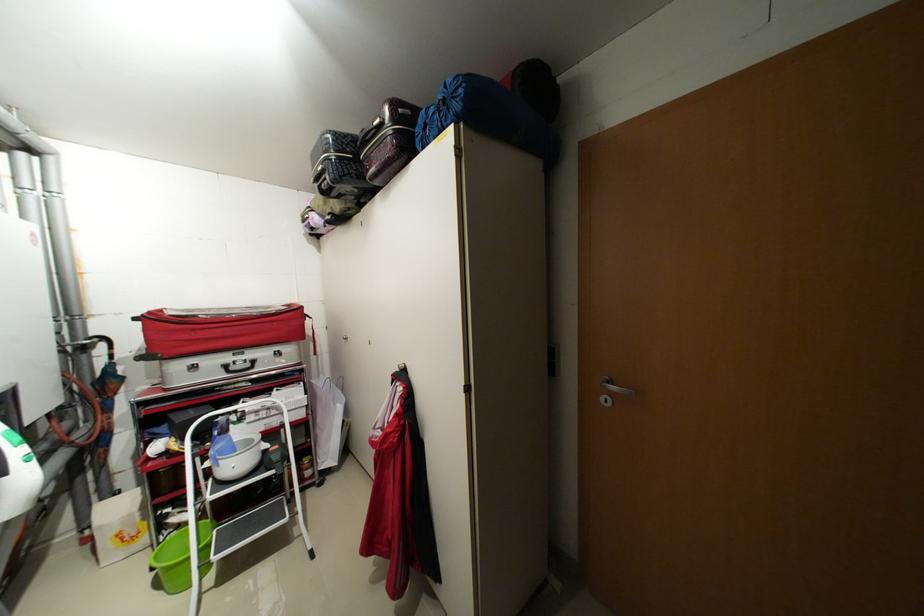
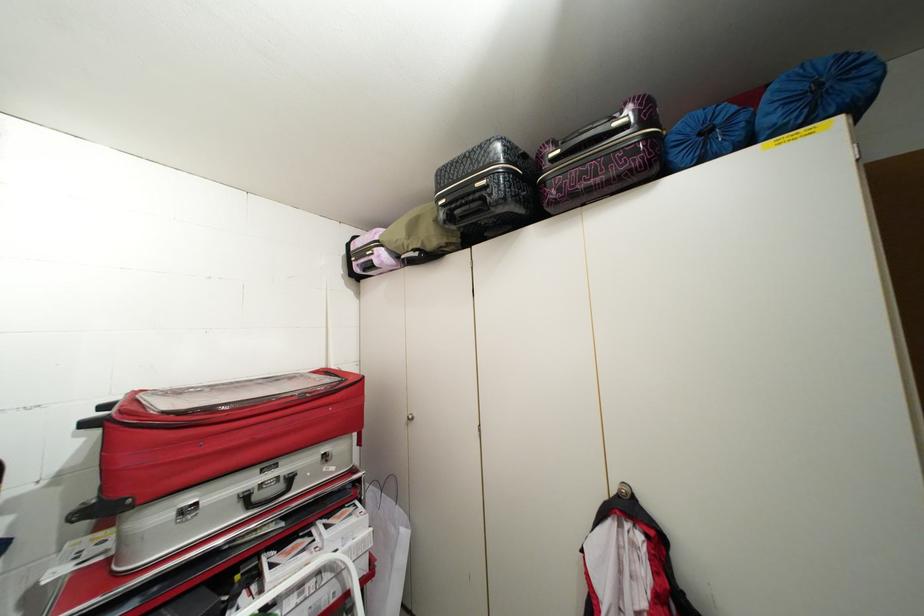
Find the pixel in the second image that matches point 254,365 in the first image.

(287, 487)